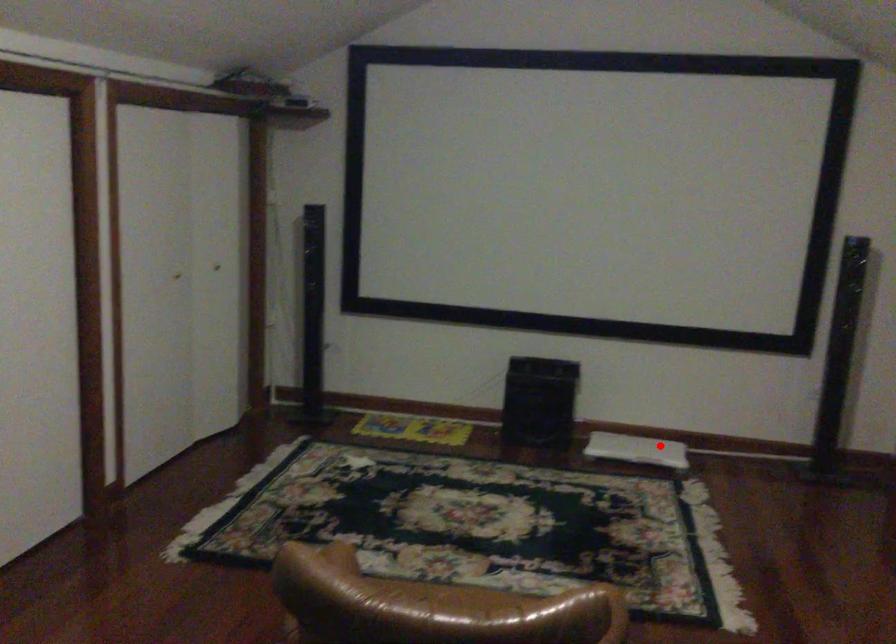
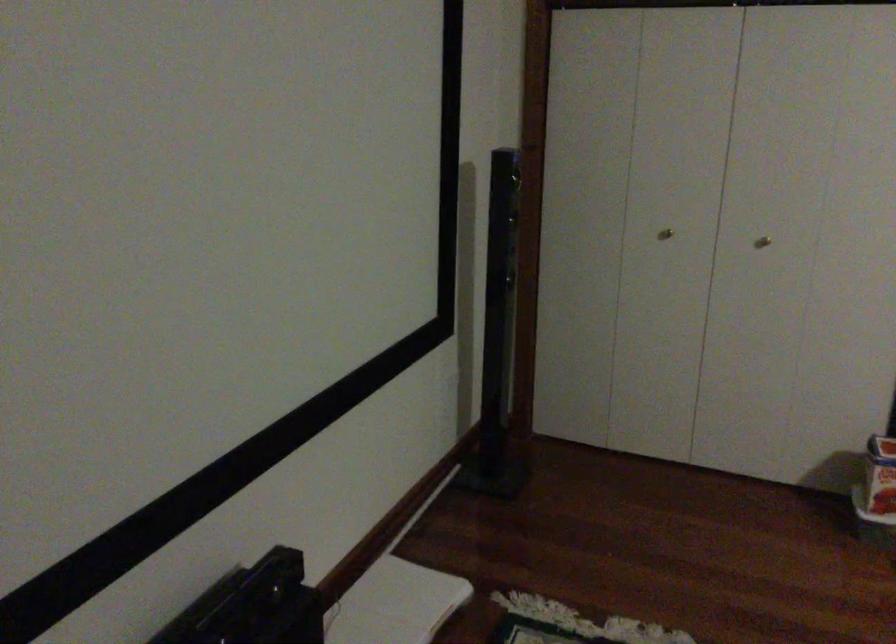
Locate, in the second image, the point that corresponds to the highlighted location in the first image.

(394, 603)